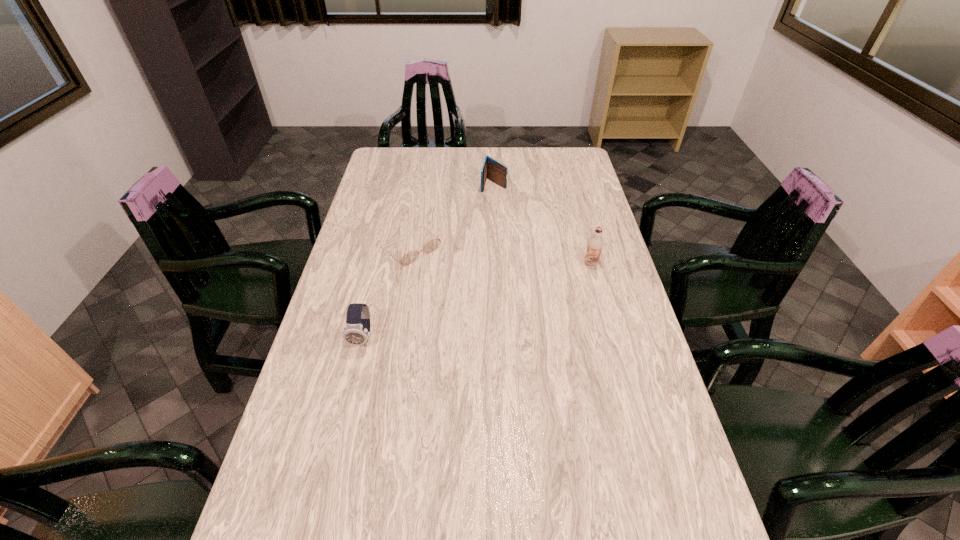
What are the coordinates of `free location located 0.150m on the exterior surface of the wallet` in the screenshot? It's located at (486, 215).

The image size is (960, 540). I want to click on vacant space located 0.090m on the face of the shortest object, so click(x=447, y=278).

Identify the location of vacant space located on the face of the shortest object. This screenshot has height=540, width=960. (459, 288).

Image resolution: width=960 pixels, height=540 pixels. I want to click on vacant space located on the face of the shortest object, so click(486, 309).

Find the location of `watch that is at the left edge`. watch that is at the left edge is located at coordinates (x=357, y=331).

The height and width of the screenshot is (540, 960). I want to click on sunglasses that is at the left edge, so click(432, 245).

Where is `object situated at the right edge`? The height and width of the screenshot is (540, 960). object situated at the right edge is located at coordinates (595, 243).

The height and width of the screenshot is (540, 960). What are the coordinates of `free space at the far edge of the desktop` in the screenshot? It's located at (493, 150).

I want to click on vacant space at the near edge, so click(418, 534).

Locate an element on the screen. The width and height of the screenshot is (960, 540). blank space at the left edge of the desktop is located at coordinates (349, 241).